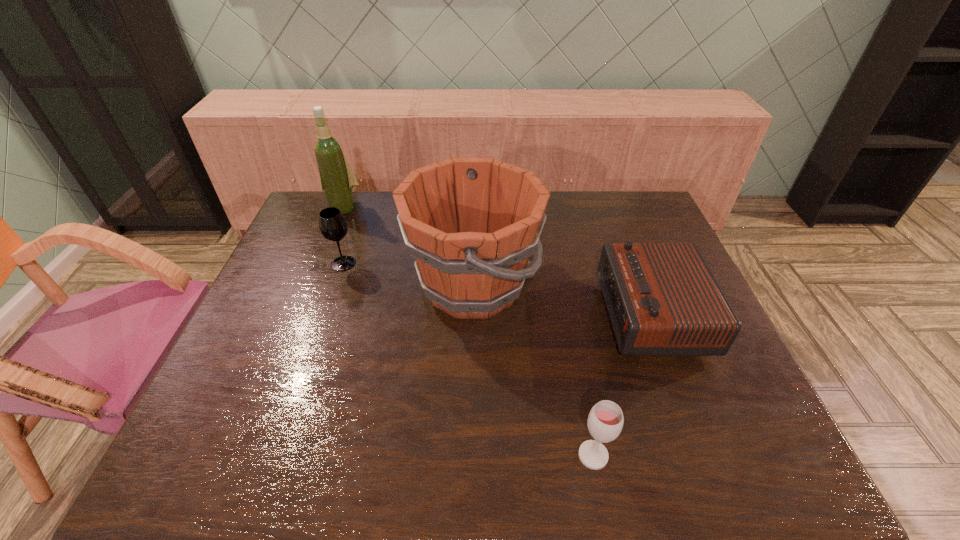
Identify the location of wine bottle. The image size is (960, 540). (337, 179).

Find the location of a particular element. This screenshot has height=540, width=960. the tallest object is located at coordinates (337, 179).

At what (x,y) coordinates should I click in order to perform the action: click on the third object from left to right. Please return your answer as a coordinate pair (x, y). This screenshot has width=960, height=540. Looking at the image, I should click on (471, 223).

Locate an element on the screen. The width and height of the screenshot is (960, 540). bucket is located at coordinates (471, 223).

At what (x,y) coordinates should I click in order to perform the action: click on the farther wineglass. Please return your answer as a coordinate pair (x, y). Looking at the image, I should click on (332, 224).

The image size is (960, 540). I want to click on the rightmost object, so click(x=662, y=298).

At what (x,y) coordinates should I click in order to perform the action: click on the right wineglass. Please return your answer as a coordinate pair (x, y). The image size is (960, 540). Looking at the image, I should click on (605, 421).

Identify the location of the nearer wineglass. (605, 421).

Locate an element on the screen. free space located on the front-facing side of the wine bottle is located at coordinates (329, 245).

Where is `free space located 0.110m on the handle side of the third object from left to right`? The width and height of the screenshot is (960, 540). free space located 0.110m on the handle side of the third object from left to right is located at coordinates (578, 286).